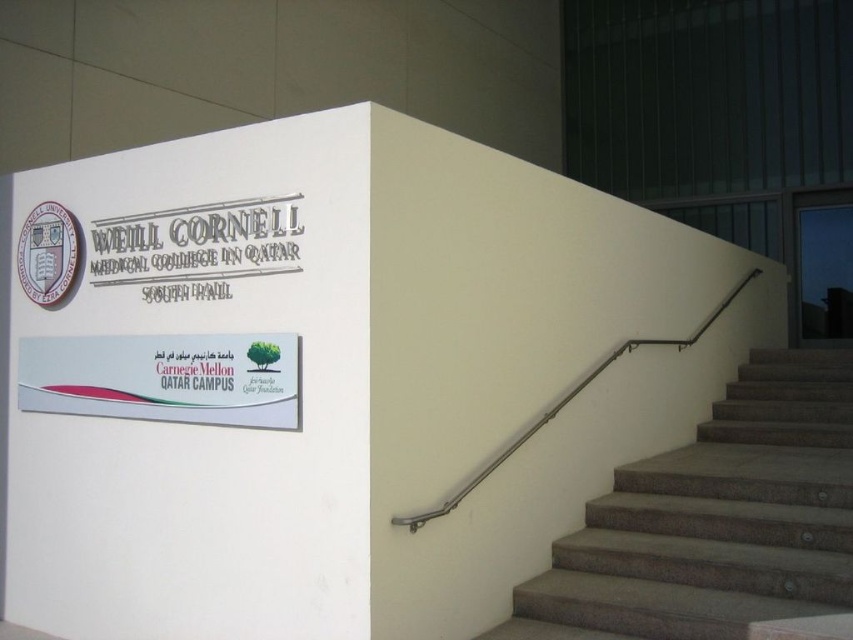
Is gray textured stairs at right smaller than satin silver handrail at right?

No, gray textured stairs at right is not smaller than satin silver handrail at right.

Can you confirm if gray textured stairs at right is positioned to the left of satin silver handrail at right?

In fact, gray textured stairs at right is to the right of satin silver handrail at right.

Where is `gray textured stairs at right`? gray textured stairs at right is located at coordinates (715, 520).

Identify the location of gray textured stairs at right. The height and width of the screenshot is (640, 853). pyautogui.click(x=715, y=520).